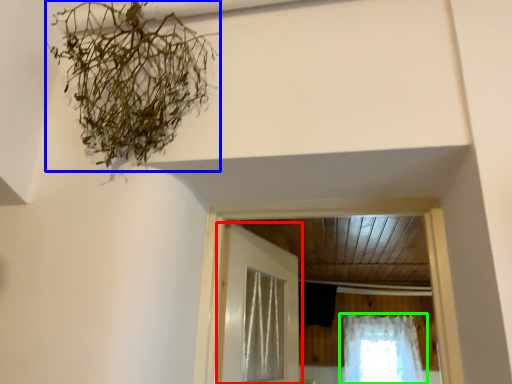
Question: Based on their relative distances, which object is farther from door (highlighted by a red box)? Choose from plant (highlighted by a blue box) and curtain (highlighted by a green box).

Choices:
 (A) plant
 (B) curtain

Answer: (B)